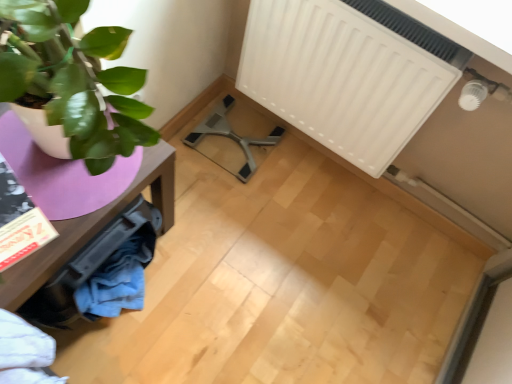
Question: From a real-world perspective, is matte purple table at left located beneath metallic gray swivel chair at center?

Choices:
 (A) yes
 (B) no

Answer: (B)

Question: Considering the relative sizes of matte purple table at left and metallic gray swivel chair at center in the image provided, is matte purple table at left shorter than metallic gray swivel chair at center?

Choices:
 (A) yes
 (B) no

Answer: (B)

Question: Is matte purple table at left closer to camera compared to metallic gray swivel chair at center?

Choices:
 (A) no
 (B) yes

Answer: (B)

Question: Can you confirm if matte purple table at left is bigger than metallic gray swivel chair at center?

Choices:
 (A) yes
 (B) no

Answer: (A)

Question: Is matte purple table at left behind metallic gray swivel chair at center?

Choices:
 (A) yes
 (B) no

Answer: (B)

Question: From the image's perspective, is metallic gray swivel chair at center located above or below matte purple table at left?

Choices:
 (A) below
 (B) above

Answer: (B)

Question: Is metallic gray swivel chair at center wider or thinner than matte purple table at left?

Choices:
 (A) thin
 (B) wide

Answer: (A)

Question: Does point (221, 102) appear closer or farther from the camera than point (58, 231)?

Choices:
 (A) farther
 (B) closer

Answer: (A)

Question: Visually, is metallic gray swivel chair at center positioned to the left or to the right of matte purple table at left?

Choices:
 (A) left
 (B) right

Answer: (B)

Question: From a real-world perspective, relative to white matte radiator at upper right, is matte purple table at left vertically above or below?

Choices:
 (A) below
 (B) above

Answer: (A)

Question: Relative to white matte radiator at upper right, is matte purple table at left in front or behind?

Choices:
 (A) behind
 (B) front

Answer: (B)

Question: From the image's perspective, is matte purple table at left located above or below white matte radiator at upper right?

Choices:
 (A) below
 (B) above

Answer: (A)

Question: Looking at the image, does matte purple table at left seem bigger or smaller compared to white matte radiator at upper right?

Choices:
 (A) big
 (B) small

Answer: (A)

Question: From the image's perspective, is white matte radiator at upper right above or below matte purple table at left?

Choices:
 (A) above
 (B) below

Answer: (A)

Question: Is point (268, 67) closer or farther from the camera than point (80, 244)?

Choices:
 (A) closer
 (B) farther

Answer: (B)